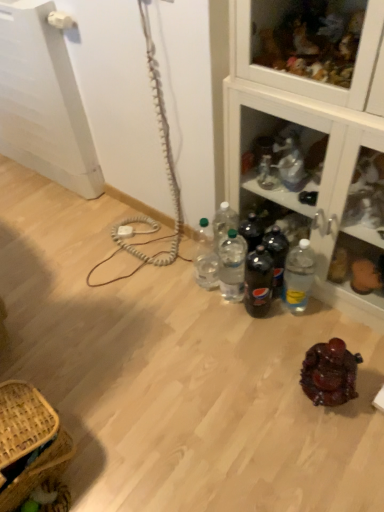
This screenshot has width=384, height=512. What do you see at coordinates (29, 443) in the screenshot?
I see `brown woven picnic basket at lower left` at bounding box center [29, 443].

The height and width of the screenshot is (512, 384). I want to click on dark glass bottle at center, the third bottle viewed from the left, so click(x=258, y=282).

Identify the location of shiny brown candy at center. The width and height of the screenshot is (384, 512). (x=330, y=373).

Considering the sizes of shiny brown candy at center and clear plastic bottles at center, the first bottle in the left-to-right sequence, in the image, is shiny brown candy at center bigger or smaller than clear plastic bottles at center, the first bottle in the left-to-right sequence,?

Considering their sizes, shiny brown candy at center takes up more space than clear plastic bottles at center, the first bottle in the left-to-right sequence.

From a real-world perspective, which is physically below, shiny brown candy at center or clear plastic bottles at center, the fifth bottle positioned from the right?

In real-world perspective, shiny brown candy at center is lower.

From the picture: Considering the sizes of objects shiny brown candy at center and clear plastic bottles at center, the fifth bottle positioned from the right, in the image provided, who is taller, shiny brown candy at center or clear plastic bottles at center, the fifth bottle positioned from the right,?

Standing taller between the two is clear plastic bottles at center, the fifth bottle positioned from the right.

Is translucent plastic soda bottles at center, which is counted as the second bottle, starting from the right, next to dark glass bottle at center, the 3th bottle positioned from the right, and touching it?

Yes, translucent plastic soda bottles at center, which is counted as the second bottle, starting from the right, is beside dark glass bottle at center, the 3th bottle positioned from the right.

Is dark glass bottle at center, the 3th bottle positioned from the right, located within translucent plastic soda bottles at center, the fourth bottle from the left?

No, dark glass bottle at center, the 3th bottle positioned from the right, is not surrounded by translucent plastic soda bottles at center, the fourth bottle from the left.

Is shiny brown candy at center facing away from clear plastic bottles at center, positioned as the fourth bottle in right-to-left order?

shiny brown candy at center is not turned away from clear plastic bottles at center, positioned as the fourth bottle in right-to-left order.

Looking at their sizes, would you say shiny brown candy at center is wider or thinner than clear plastic bottles at center, positioned as the fourth bottle in right-to-left order?

In the image, shiny brown candy at center appears to be wider than clear plastic bottles at center, positioned as the fourth bottle in right-to-left order.

The height and width of the screenshot is (512, 384). I want to click on food lying below the clear plastic bottles at center, positioned as the fourth bottle in right-to-left order (from the image's perspective), so click(330, 373).

From the image's perspective, is shiny brown candy at center positioned above or below clear plastic bottles at center, marked as the second bottle in a left-to-right arrangement?

shiny brown candy at center is situated lower than clear plastic bottles at center, marked as the second bottle in a left-to-right arrangement, in the image.

Based on the photo, is clear plastic bottle at lower right, which is counted as the fifth bottle, starting from the left, not close to clear plastic bottles at center, the first bottle in the left-to-right sequence?

They are positioned close to each other.

From the picture: Does clear plastic bottle at lower right, which appears as the 1th bottle when viewed from the right, turn towards clear plastic bottles at center, the fifth bottle positioned from the right?

No, clear plastic bottle at lower right, which appears as the 1th bottle when viewed from the right, is not turned towards clear plastic bottles at center, the fifth bottle positioned from the right.

What's the angular difference between clear plastic bottle at lower right, which is counted as the fifth bottle, starting from the left, and clear plastic bottles at center, the first bottle in the left-to-right sequence,'s facing directions?

They differ by 0.000503 degrees in their facing directions.

How far apart are clear plastic bottles at center, marked as the second bottle in a left-to-right arrangement, and translucent plastic soda bottles at center, the fourth bottle from the left?

A distance of 6.04 inches exists between clear plastic bottles at center, marked as the second bottle in a left-to-right arrangement, and translucent plastic soda bottles at center, the fourth bottle from the left.

Image resolution: width=384 pixels, height=512 pixels. I want to click on the 1st bottle in front of the clear plastic bottles at center, positioned as the fourth bottle in right-to-left order, starting your count from the anchor, so click(x=277, y=256).

From a real-world perspective, who is located lower, clear plastic bottles at center, positioned as the fourth bottle in right-to-left order, or translucent plastic soda bottles at center, which is counted as the second bottle, starting from the right?

translucent plastic soda bottles at center, which is counted as the second bottle, starting from the right, is physically lower.

Is clear plastic bottles at center, marked as the second bottle in a left-to-right arrangement, touching translucent plastic soda bottles at center, the fourth bottle from the left?

clear plastic bottles at center, marked as the second bottle in a left-to-right arrangement, is not next to translucent plastic soda bottles at center, the fourth bottle from the left, and they're not touching.

Is dark glass bottle at center, the third bottle viewed from the left, inside or outside of clear plastic bottles at center, the fifth bottle positioned from the right?

dark glass bottle at center, the third bottle viewed from the left, is outside clear plastic bottles at center, the fifth bottle positioned from the right.

Which of these two, dark glass bottle at center, the third bottle viewed from the left, or clear plastic bottles at center, the first bottle in the left-to-right sequence, is bigger?

clear plastic bottles at center, the first bottle in the left-to-right sequence, is bigger.

Is dark glass bottle at center, the 3th bottle positioned from the right, facing towards clear plastic bottles at center, the fifth bottle positioned from the right?

No, dark glass bottle at center, the 3th bottle positioned from the right, is not turned towards clear plastic bottles at center, the fifth bottle positioned from the right.

Is clear glass cabinet at upper right at the right side of clear plastic bottles at center, positioned as the fourth bottle in right-to-left order?

Correct, you'll find clear glass cabinet at upper right to the right of clear plastic bottles at center, positioned as the fourth bottle in right-to-left order.

Considering the sizes of objects clear glass cabinet at upper right and clear plastic bottles at center, positioned as the fourth bottle in right-to-left order, in the image provided, who is bigger, clear glass cabinet at upper right or clear plastic bottles at center, positioned as the fourth bottle in right-to-left order,?

With larger size is clear glass cabinet at upper right.

Considering the relative sizes of clear glass cabinet at upper right and clear plastic bottles at center, marked as the second bottle in a left-to-right arrangement, in the image provided, is clear glass cabinet at upper right shorter than clear plastic bottles at center, marked as the second bottle in a left-to-right arrangement,?

No, clear glass cabinet at upper right is not shorter than clear plastic bottles at center, marked as the second bottle in a left-to-right arrangement.

Is clear glass cabinet at upper right facing towards clear plastic bottles at center, positioned as the fourth bottle in right-to-left order?

Yes.

From the shiny brown candy at center, count 5th bottles backward and point to it. Please provide its 2D coordinates.

[(206, 258)]

Find the location of a particular element. the 1st bottle in front of the translucent plastic soda bottles at center, which is counted as the second bottle, starting from the right is located at coordinates (258, 282).

Which object lies further to the anchor point shiny brown candy at center, clear plastic bottles at center, the fifth bottle positioned from the right, or translucent plastic soda bottles at center, the fourth bottle from the left?

The object further to shiny brown candy at center is clear plastic bottles at center, the fifth bottle positioned from the right.

When comparing their distances from brown woven picnic basket at lower left, does clear plastic bottles at center, the first bottle in the left-to-right sequence, or clear plastic bottle at lower right, which appears as the 1th bottle when viewed from the right, seem closer?

The object closer to brown woven picnic basket at lower left is clear plastic bottles at center, the first bottle in the left-to-right sequence.

Looking at the image, which one is located further to translucent plastic soda bottles at center, the fourth bottle from the left, shiny brown candy at center or clear plastic bottles at center, the fifth bottle positioned from the right?

Based on the image, shiny brown candy at center appears to be further to translucent plastic soda bottles at center, the fourth bottle from the left.

When comparing their distances from clear plastic bottle at lower right, which is counted as the fifth bottle, starting from the left, does shiny brown candy at center or brown woven picnic basket at lower left seem closer?

shiny brown candy at center lies closer to clear plastic bottle at lower right, which is counted as the fifth bottle, starting from the left, than the other object.

Estimate the real-world distances between objects in this image. Which object is further from brown woven picnic basket at lower left, dark glass bottle at center, the 3th bottle positioned from the right, or clear plastic bottles at center, marked as the second bottle in a left-to-right arrangement?

dark glass bottle at center, the 3th bottle positioned from the right, lies further to brown woven picnic basket at lower left than the other object.

Based on their spatial positions, is dark glass bottle at center, the third bottle viewed from the left, or clear glass cabinet at upper right closer to brown woven picnic basket at lower left?

dark glass bottle at center, the third bottle viewed from the left, lies closer to brown woven picnic basket at lower left than the other object.

From the image, which object appears to be farther from brown woven picnic basket at lower left, clear plastic bottles at center, the fifth bottle positioned from the right, or translucent plastic soda bottles at center, the fourth bottle from the left?

translucent plastic soda bottles at center, the fourth bottle from the left, is positioned further to the anchor brown woven picnic basket at lower left.

Estimate the real-world distances between objects in this image. Which object is further from clear plastic bottles at center, the fifth bottle positioned from the right, brown woven picnic basket at lower left or clear plastic bottles at center, positioned as the fourth bottle in right-to-left order?

brown woven picnic basket at lower left lies further to clear plastic bottles at center, the fifth bottle positioned from the right, than the other object.

This screenshot has height=512, width=384. I want to click on bottle between clear plastic bottle at lower right, which is counted as the fifth bottle, starting from the left, and shiny brown candy at center, in the vertical direction, so coord(258,282).

You are a GUI agent. You are given a task and a screenshot of the screen. Output one action in this format:
    pyautogui.click(x=<x>, y=<y>)
    Task: Click on the bottle between dark glass bottle at center, the third bottle viewed from the left, and clear plastic bottle at lower right, which appears as the 1th bottle when viewed from the right, in the horizontal direction
    
    Given the screenshot: What is the action you would take?
    pyautogui.click(x=277, y=256)

I want to click on bottle located between clear plastic bottles at center, the first bottle in the left-to-right sequence, and dark glass bottle at center, the 3th bottle positioned from the right, in the left-right direction, so click(x=232, y=265).

Image resolution: width=384 pixels, height=512 pixels. I want to click on bottle between clear plastic bottles at center, marked as the second bottle in a left-to-right arrangement, and translucent plastic soda bottles at center, the fourth bottle from the left, so click(258, 282).